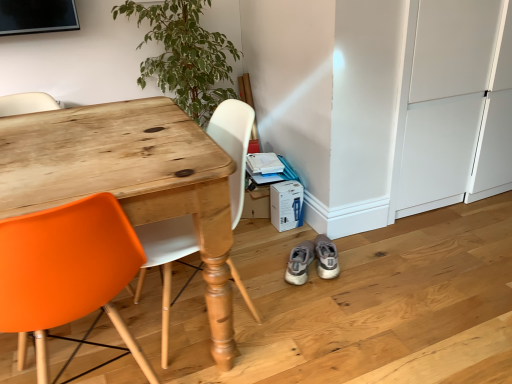
This screenshot has width=512, height=384. What do you see at coordinates (326, 257) in the screenshot? I see `light gray suede sneakers at lower center, the 1th footwear from the right` at bounding box center [326, 257].

Measure the distance between point (x=323, y=260) and camera.

They are 6.24 feet apart.

Find the location of a particular element. The height and width of the screenshot is (384, 512). white cardboard box at lower center is located at coordinates (286, 205).

What do you see at coordinates (286, 205) in the screenshot?
I see `white cardboard box at lower center` at bounding box center [286, 205].

How much space does gray suede sneakers at lower right, which ranks as the second footwear in right-to-left order, occupy vertically?

4.62 inches.

This screenshot has width=512, height=384. I want to click on wooden desk at left, so click(x=137, y=188).

This screenshot has height=384, width=512. In order to click on light gray suede sneakers at lower center, positioned as the second footwear in left-to-right order in this screenshot , I will do `click(326, 257)`.

Is green leafy plant at upper left shorter than gray suede sneakers at lower right, which is the 1th footwear from left to right?

No.

Locate an element on the screen. The height and width of the screenshot is (384, 512). the 2nd footwear below the green leafy plant at upper left (from the image's perspective) is located at coordinates (298, 263).

Looking at this image, is green leafy plant at upper left directly adjacent to gray suede sneakers at lower right, which is the 1th footwear from left to right?

No, green leafy plant at upper left is not next to gray suede sneakers at lower right, which is the 1th footwear from left to right.

Which object is closer to the camera taking this photo, green leafy plant at upper left or gray suede sneakers at lower right, which ranks as the second footwear in right-to-left order?

gray suede sneakers at lower right, which ranks as the second footwear in right-to-left order, is closer to the camera.

Can you confirm if green leafy plant at upper left is positioned to the right of wooden desk at left?

Yes, green leafy plant at upper left is to the right of wooden desk at left.

From a real-world perspective, which object stands above the other?

green leafy plant at upper left is physically above.

Image resolution: width=512 pixels, height=384 pixels. I want to click on houseplant to the right of wooden desk at left, so click(x=185, y=55).

Which object is positioned more to the right, green leafy plant at upper left or white cardboard box at lower center?

Positioned to the right is white cardboard box at lower center.

Which is behind, green leafy plant at upper left or white cardboard box at lower center?

white cardboard box at lower center.

Is green leafy plant at upper left turned away from white cardboard box at lower center?

green leafy plant at upper left does not have its back to white cardboard box at lower center.

From the picture: From the image's perspective, is green leafy plant at upper left on top of white cardboard box at lower center?

Indeed, from the image's perspective, green leafy plant at upper left is shown above white cardboard box at lower center.

Can you confirm if wooden desk at left is smaller than green leafy plant at upper left?

Actually, wooden desk at left might be larger than green leafy plant at upper left.

From the image's perspective, relative to green leafy plant at upper left, is wooden desk at left above or below?

From the image's perspective, wooden desk at left appears below green leafy plant at upper left.

Is wooden desk at left positioned with its back to green leafy plant at upper left?

Yes, green leafy plant at upper left is at the back of wooden desk at left.

Based on the photo, from a real-world perspective, is wooden desk at left above or below light gray suede sneakers at lower center, the 1th footwear from the right?

Clearly, from a real-world perspective, wooden desk at left is above light gray suede sneakers at lower center, the 1th footwear from the right.

From the image's perspective, is wooden desk at left located above light gray suede sneakers at lower center, positioned as the second footwear in left-to-right order?

Correct, wooden desk at left appears higher than light gray suede sneakers at lower center, positioned as the second footwear in left-to-right order, in the image.

Which of these two, wooden desk at left or light gray suede sneakers at lower center, positioned as the second footwear in left-to-right order, is bigger?

wooden desk at left.

Is wooden desk at left facing away from light gray suede sneakers at lower center, the 1th footwear from the right?

wooden desk at left does not have its back to light gray suede sneakers at lower center, the 1th footwear from the right.

Which object is positioned more to the left, gray suede sneakers at lower right, which is the 1th footwear from left to right, or green leafy plant at upper left?

From the viewer's perspective, green leafy plant at upper left appears more on the left side.

Considering the relative positions of gray suede sneakers at lower right, which is the 1th footwear from left to right, and green leafy plant at upper left in the image provided, is gray suede sneakers at lower right, which is the 1th footwear from left to right, in front of green leafy plant at upper left?

Yes, gray suede sneakers at lower right, which is the 1th footwear from left to right, is in front of green leafy plant at upper left.

Who is shorter, gray suede sneakers at lower right, which ranks as the second footwear in right-to-left order, or green leafy plant at upper left?

gray suede sneakers at lower right, which ranks as the second footwear in right-to-left order, is shorter.

How many degrees apart are the facing directions of gray suede sneakers at lower right, which ranks as the second footwear in right-to-left order, and green leafy plant at upper left?

The facing directions of gray suede sneakers at lower right, which ranks as the second footwear in right-to-left order, and green leafy plant at upper left are 24.6 degrees apart.

From the image's perspective, which is below, gray suede sneakers at lower right, which ranks as the second footwear in right-to-left order, or white cardboard box at lower center?

gray suede sneakers at lower right, which ranks as the second footwear in right-to-left order, appears lower in the image.

Measure the distance from gray suede sneakers at lower right, which ranks as the second footwear in right-to-left order, to white cardboard box at lower center.

The distance of gray suede sneakers at lower right, which ranks as the second footwear in right-to-left order, from white cardboard box at lower center is 11.78 inches.

What's the angular difference between gray suede sneakers at lower right, which ranks as the second footwear in right-to-left order, and white cardboard box at lower center's facing directions?

There is a 23.7-degree angle between the facing directions of gray suede sneakers at lower right, which ranks as the second footwear in right-to-left order, and white cardboard box at lower center.

From the picture: From a real-world perspective, is gray suede sneakers at lower right, which is the 1th footwear from left to right, on white cardboard box at lower center?

No, from a real-world perspective, gray suede sneakers at lower right, which is the 1th footwear from left to right, is not above white cardboard box at lower center.

Identify the location of houseplant on the left of gray suede sneakers at lower right, which ranks as the second footwear in right-to-left order. (185, 55).

You are a GUI agent. You are given a task and a screenshot of the screen. Output one action in this format:
    pyautogui.click(x=<x>, y=<y>)
    Task: Click on the desk below the green leafy plant at upper left (from the image's perspective)
    The width and height of the screenshot is (512, 384).
    Given the screenshot: What is the action you would take?
    pyautogui.click(x=137, y=188)

When comparing their distances from white cardboard box at lower center, does wooden desk at left or gray suede sneakers at lower right, which is the 1th footwear from left to right, seem further?

The object further to white cardboard box at lower center is wooden desk at left.

When comparing their distances from green leafy plant at upper left, does wooden desk at left or gray suede sneakers at lower right, which ranks as the second footwear in right-to-left order, seem further?

gray suede sneakers at lower right, which ranks as the second footwear in right-to-left order, is further to green leafy plant at upper left.

Looking at the image, which one is located closer to wooden desk at left, white cardboard box at lower center or light gray suede sneakers at lower center, the 1th footwear from the right?

Based on the image, white cardboard box at lower center appears to be nearer to wooden desk at left.

Considering their positions, is wooden desk at left positioned closer to light gray suede sneakers at lower center, the 1th footwear from the right, than white cardboard box at lower center?

Based on the image, white cardboard box at lower center appears to be nearer to light gray suede sneakers at lower center, the 1th footwear from the right.

Consider the image. When comparing their distances from gray suede sneakers at lower right, which ranks as the second footwear in right-to-left order, does green leafy plant at upper left or wooden desk at left seem closer?

Based on the image, wooden desk at left appears to be nearer to gray suede sneakers at lower right, which ranks as the second footwear in right-to-left order.

From the image, which object appears to be nearer to green leafy plant at upper left, wooden desk at left or white cardboard box at lower center?

Among the two, wooden desk at left is located nearer to green leafy plant at upper left.

Which object lies further to the anchor point gray suede sneakers at lower right, which ranks as the second footwear in right-to-left order, light gray suede sneakers at lower center, the 1th footwear from the right, or green leafy plant at upper left?

green leafy plant at upper left is positioned further to the anchor gray suede sneakers at lower right, which ranks as the second footwear in right-to-left order.

Which object lies further to the anchor point gray suede sneakers at lower right, which ranks as the second footwear in right-to-left order, white cardboard box at lower center or wooden desk at left?

wooden desk at left is further to gray suede sneakers at lower right, which ranks as the second footwear in right-to-left order.

Find the location of a particular element. This screenshot has width=512, height=384. box between green leafy plant at upper left and gray suede sneakers at lower right, which ranks as the second footwear in right-to-left order, vertically is located at coordinates (286, 205).

The height and width of the screenshot is (384, 512). In order to click on box that lies between green leafy plant at upper left and light gray suede sneakers at lower center, positioned as the second footwear in left-to-right order, from top to bottom in this screenshot , I will do `click(286, 205)`.

Locate an element on the screen. This screenshot has width=512, height=384. footwear located between wooden desk at left and light gray suede sneakers at lower center, the 1th footwear from the right, in the depth direction is located at coordinates (298, 263).

Image resolution: width=512 pixels, height=384 pixels. Identify the location of footwear between gray suede sneakers at lower right, which is the 1th footwear from left to right, and white cardboard box at lower center from front to back. [x=326, y=257].